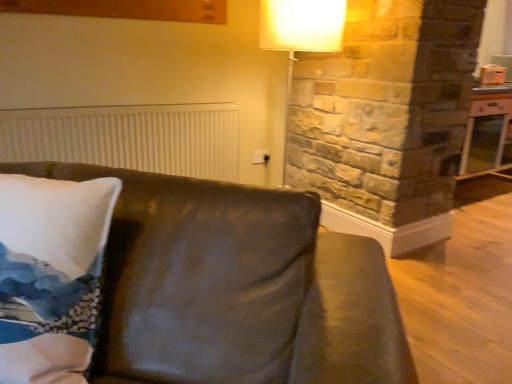
Question: From their relative heights in the image, would you say white ribbed radiator at upper left is taller or shorter than wooden table at right?

Choices:
 (A) short
 (B) tall

Answer: (A)

Question: Considering the relative positions of white ribbed radiator at upper left and wooden table at right in the image provided, is white ribbed radiator at upper left to the left or to the right of wooden table at right?

Choices:
 (A) right
 (B) left

Answer: (B)

Question: Estimate the real-world distances between objects in this image. Which object is closer to the white ribbed radiator at upper left?

Choices:
 (A) wooden table at right
 (B) leather couch at center

Answer: (B)

Question: Which object is positioned closest to the wooden table at right?

Choices:
 (A) leather couch at center
 (B) white ribbed radiator at upper left

Answer: (B)